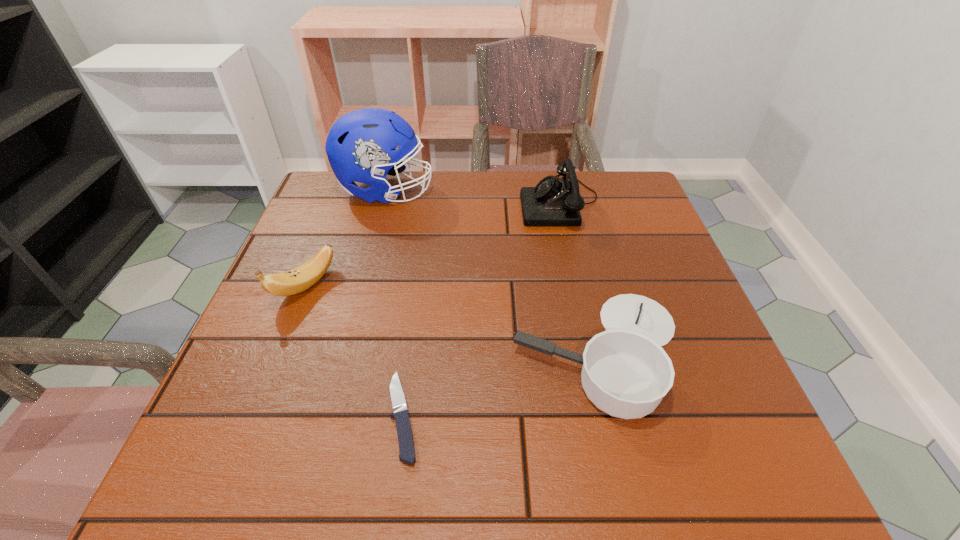
Find the location of a particular element. This screenshot has width=960, height=540. blank area in the image that satisfies the following two spatial constraints: 1. on the front face of the saucepan; 2. on the right side of the telephone is located at coordinates (593, 351).

Image resolution: width=960 pixels, height=540 pixels. I want to click on free region that satisfies the following two spatial constraints: 1. on the front face of the telephone; 2. on the back side of the saucepan, so click(x=593, y=351).

Where is `vacant point that satisfies the following two spatial constraints: 1. on the front face of the telephone; 2. on the front side of the banana`? The image size is (960, 540). vacant point that satisfies the following two spatial constraints: 1. on the front face of the telephone; 2. on the front side of the banana is located at coordinates (579, 286).

This screenshot has height=540, width=960. I want to click on free location that satisfies the following two spatial constraints: 1. on the front side of the banana; 2. on the right side of the steak knife, so click(253, 416).